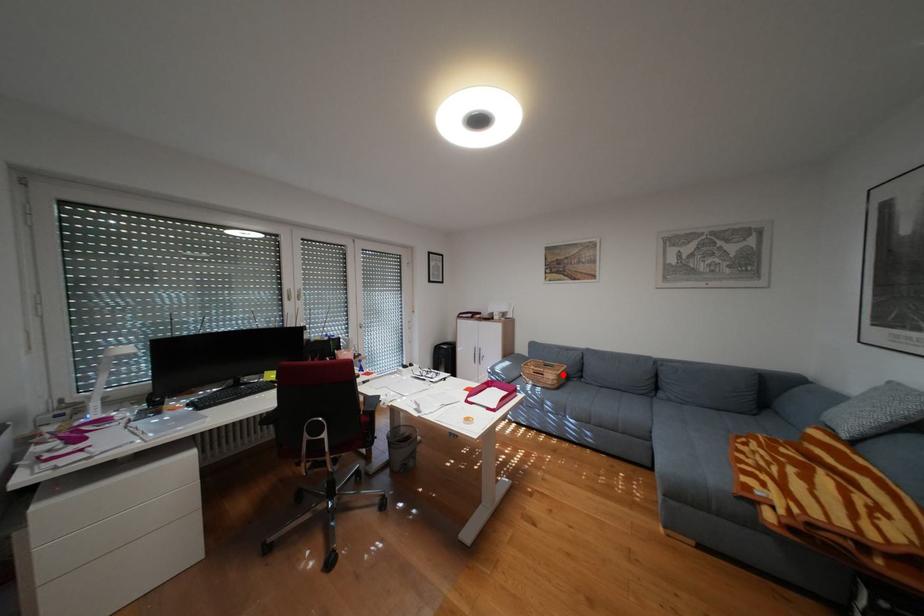
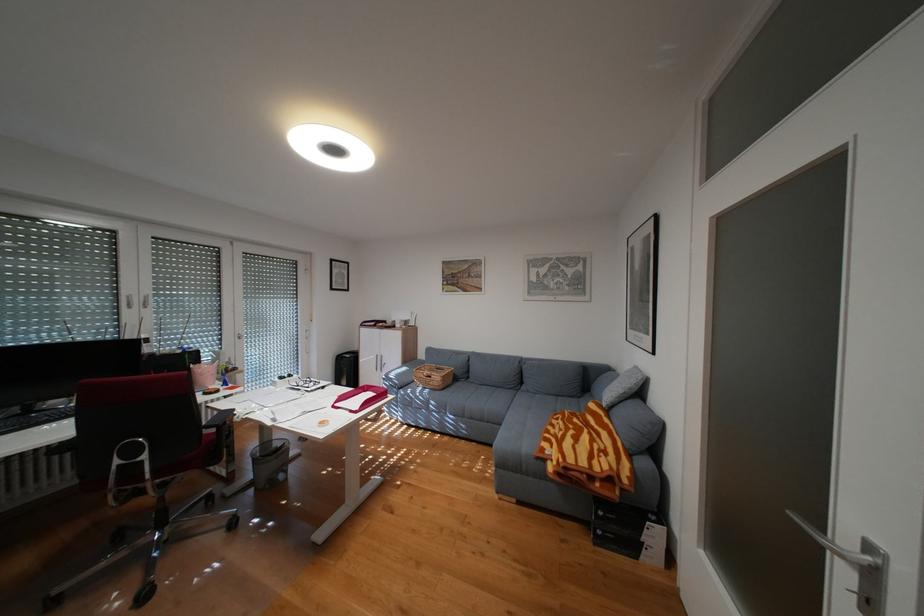
Question: I am providing you with two images of the same scene from different viewpoints. Image1 has a red point marked. In image2, the corresponding 3D location appears at what relative position? Reply with the corresponding letter.

Choices:
 (A) Closer
 (B) Farther

Answer: (B)